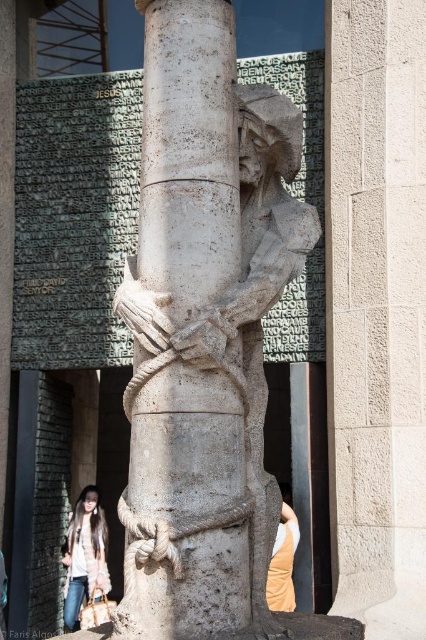
Does light brown fur coat at lower left have a lesser height compared to beige fabric at lower right?

Yes, light brown fur coat at lower left is shorter than beige fabric at lower right.

Who is positioned more to the right, light brown fur coat at lower left or beige fabric at lower right?

From the viewer's perspective, beige fabric at lower right appears more on the right side.

Does point (83, 499) come in front of point (290, 516)?

No, (83, 499) is further to viewer.

Where is `light brown fur coat at lower left`? The image size is (426, 640). light brown fur coat at lower left is located at coordinates (85, 556).

Is the position of white stone column at center more distant than that of light brown fur coat at lower left?

That is False.

Where is `white stone column at center`? The height and width of the screenshot is (640, 426). white stone column at center is located at coordinates (187, 154).

Identify the location of white stone column at center. (187, 154).

Who is shorter, white stone column at center or beige fabric at lower right?

beige fabric at lower right is shorter.

Does white stone column at center have a greater height compared to beige fabric at lower right?

Correct, white stone column at center is much taller as beige fabric at lower right.

Where is `white stone column at center`? white stone column at center is located at coordinates (187, 154).

Where is `white stone column at center`? white stone column at center is located at coordinates (187, 154).